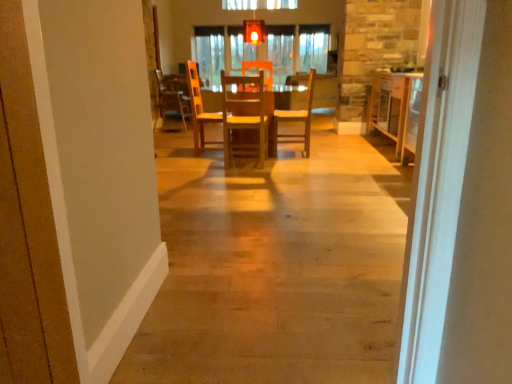
Describe the element at coordinates (396, 109) in the screenshot. The image size is (512, 384). I see `wooden table at center, which is the 2th table from left to right` at that location.

What is the approximate height of wooden chair at center, which ranks as the 2th chair in back-to-front order?

wooden chair at center, which ranks as the 2th chair in back-to-front order, is 37.61 inches in height.

Identify the location of matte glass light fixture at upper center. (254, 31).

Describe the element at coordinates (288, 116) in the screenshot. I see `wooden table at center, the second table when ordered from right to left` at that location.

The height and width of the screenshot is (384, 512). What do you see at coordinates (275, 268) in the screenshot? I see `wooden floor at center` at bounding box center [275, 268].

I want to click on wooden table at center, marked as the 1th table in a right-to-left arrangement, so (x=396, y=109).

Is matte glass light fixture at upper center at the right side of wooden chair at center, the second chair positioned from the front?

No, matte glass light fixture at upper center is not to the right of wooden chair at center, the second chair positioned from the front.

At what (x,y) coordinates should I click in order to perform the action: click on light fixture located above the wooden chair at center, the third chair when ordered from left to right (from the image's perspective). Please return your answer as a coordinate pair (x, y). Looking at the image, I should click on (254, 31).

Are matte glass light fixture at upper center and wooden chair at center, marked as the first chair in a right-to-left arrangement, far apart?

matte glass light fixture at upper center is positioned a significant distance from wooden chair at center, marked as the first chair in a right-to-left arrangement.

Can you confirm if matte glass light fixture at upper center is shorter than wooden chair at center, the second chair positioned from the front?

Indeed, matte glass light fixture at upper center has a lesser height compared to wooden chair at center, the second chair positioned from the front.

Is wooden chair at center, the third chair when ordered from left to right, a part of wooden table at center, which is the 1th table in left-to-right order?

Yes, wooden chair at center, the third chair when ordered from left to right, is a part of wooden table at center, which is the 1th table in left-to-right order.

From the picture: Could you tell me if wooden table at center, the second table when ordered from right to left, is facing wooden chair at center, marked as the first chair in a right-to-left arrangement?

No, wooden table at center, the second table when ordered from right to left, is not turned towards wooden chair at center, marked as the first chair in a right-to-left arrangement.

From a real-world perspective, who is located higher, wooden table at center, the second table when ordered from right to left, or wooden chair at center, which ranks as the 2th chair in back-to-front order?

In real-world perspective, wooden chair at center, which ranks as the 2th chair in back-to-front order, is above.

Considering the sizes of wooden table at center, which is the 1th table in left-to-right order, and wooden chair at center, marked as the first chair in a right-to-left arrangement, in the image, is wooden table at center, which is the 1th table in left-to-right order, wider or thinner than wooden chair at center, marked as the first chair in a right-to-left arrangement,?

Result: wooden table at center, which is the 1th table in left-to-right order, is wider than wooden chair at center, marked as the first chair in a right-to-left arrangement.

Looking at this image, can you tell me how much matte glass light fixture at upper center and wooden chair at center, which is the first chair from left to right, differ in facing direction?

There is a 95.3-degree angle between the facing directions of matte glass light fixture at upper center and wooden chair at center, which is the first chair from left to right.

Is point (263, 33) closer or farther from the camera than point (168, 91)?

Clearly, point (263, 33) is closer to the camera than point (168, 91).

Considering the relative sizes of matte glass light fixture at upper center and wooden chair at center, the first chair in the back-to-front sequence, in the image provided, is matte glass light fixture at upper center taller than wooden chair at center, the first chair in the back-to-front sequence,?

No.

From a real-world perspective, which is physically above, matte glass light fixture at upper center or wooden chair at center, which appears as the 3th chair when viewed from the right?

matte glass light fixture at upper center is physically above.

Consider the image. From the image's perspective, would you say wooden chair at center, marked as the first chair in a right-to-left arrangement, is shown under wooden floor at center?

Actually, wooden chair at center, marked as the first chair in a right-to-left arrangement, appears above wooden floor at center in the image.

Between wooden chair at center, marked as the first chair in a right-to-left arrangement, and wooden floor at center, which one has smaller width?

Thinner between the two is wooden chair at center, marked as the first chair in a right-to-left arrangement.

Is wooden chair at center, marked as the first chair in a right-to-left arrangement, aimed at wooden floor at center?

No, wooden chair at center, marked as the first chair in a right-to-left arrangement, is not turned towards wooden floor at center.

Is wooden chair at center, marked as the first chair in a right-to-left arrangement, bigger than wooden floor at center?

Incorrect, wooden chair at center, marked as the first chair in a right-to-left arrangement, is not larger than wooden floor at center.

Based on the photo, is wooden floor at center completely or partially inside matte glass light fixture at upper center?

Definitely not — wooden floor at center is not inside matte glass light fixture at upper center.

Considering the sizes of matte glass light fixture at upper center and wooden floor at center in the image, is matte glass light fixture at upper center bigger or smaller than wooden floor at center?

In the image, matte glass light fixture at upper center appears to be smaller than wooden floor at center.

Are matte glass light fixture at upper center and wooden floor at center located far from each other?

Yes, matte glass light fixture at upper center is far from wooden floor at center.

From the image's perspective, which one is positioned higher, matte glass light fixture at upper center or wooden floor at center?

matte glass light fixture at upper center.

Is wooden table at center, the second table when ordered from right to left, positioned with its back to wooden chair at center, marked as the 1th chair in a front-to-back arrangement?

Yes, wooden table at center, the second table when ordered from right to left, is facing away from wooden chair at center, marked as the 1th chair in a front-to-back arrangement.

From the image's perspective, which one is positioned higher, wooden table at center, which is the 1th table in left-to-right order, or wooden chair at center, marked as the 2th chair in a right-to-left arrangement?

wooden table at center, which is the 1th table in left-to-right order, is shown above in the image.

Considering the relative sizes of wooden table at center, the second table when ordered from right to left, and wooden chair at center, which ranks as the third chair in back-to-front order, in the image provided, is wooden table at center, the second table when ordered from right to left, bigger than wooden chair at center, which ranks as the third chair in back-to-front order,?

Correct, wooden table at center, the second table when ordered from right to left, is larger in size than wooden chair at center, which ranks as the third chair in back-to-front order.

Does point (244, 134) lie in front of point (257, 139)?

No, it is not.

Looking at this image, considering the sizes of wooden table at center, which is the 1th table in left-to-right order, and wooden floor at center in the image, is wooden table at center, which is the 1th table in left-to-right order, bigger or smaller than wooden floor at center?

wooden table at center, which is the 1th table in left-to-right order, is smaller than wooden floor at center.

Between wooden table at center, which is the 1th table in left-to-right order, and wooden floor at center, which one has more height?

wooden table at center, which is the 1th table in left-to-right order, is taller.

Is wooden table at center, which is the 1th table in left-to-right order, closer to the viewer compared to wooden floor at center?

No, the depth of wooden table at center, which is the 1th table in left-to-right order, is greater than that of wooden floor at center.

From a real-world perspective, which is physically below, wooden table at center, which is the 1th table in left-to-right order, or wooden floor at center?

wooden floor at center is physically lower.

This screenshot has height=384, width=512. I want to click on chair that is the 2nd object located below the matte glass light fixture at upper center (from the image's perspective), so [298, 118].

Find the location of a particular element. This screenshot has height=384, width=512. the 2nd table located beneath the wooden chair at center, which ranks as the 2th chair in back-to-front order (from a real-world perspective) is located at coordinates (288, 116).

Which object lies further to the anchor point wooden chair at center, the third chair when ordered from left to right, wooden floor at center or matte glass light fixture at upper center?

Among the two, wooden floor at center is located further to wooden chair at center, the third chair when ordered from left to right.

Which object lies nearer to the anchor point wooden table at center, which is the 1th table in left-to-right order, wooden table at center, marked as the 1th table in a right-to-left arrangement, or wooden chair at center, marked as the 1th chair in a front-to-back arrangement?

wooden chair at center, marked as the 1th chair in a front-to-back arrangement.

Looking at the image, which one is located closer to wooden table at center, marked as the 1th table in a right-to-left arrangement, wooden chair at center, the 3th chair in the front-to-back sequence, or wooden chair at center, marked as the 2th chair in a right-to-left arrangement?

wooden chair at center, marked as the 2th chair in a right-to-left arrangement, lies closer to wooden table at center, marked as the 1th table in a right-to-left arrangement, than the other object.

Looking at the image, which one is located further to wooden chair at center, marked as the 2th chair in a right-to-left arrangement, wooden table at center, which is the 2th table from left to right, or wooden table at center, which is the 1th table in left-to-right order?

wooden table at center, which is the 2th table from left to right, lies further to wooden chair at center, marked as the 2th chair in a right-to-left arrangement, than the other object.

Considering their positions, is wooden table at center, the second table when ordered from right to left, positioned closer to matte glass light fixture at upper center than wooden chair at center, the 3th chair in the front-to-back sequence?

wooden table at center, the second table when ordered from right to left, is closer to matte glass light fixture at upper center.

Looking at the image, which one is located further to wooden chair at center, marked as the 2th chair in a right-to-left arrangement, wooden chair at center, the first chair in the back-to-front sequence, or wooden table at center, the second table when ordered from right to left?

Based on the image, wooden chair at center, the first chair in the back-to-front sequence, appears to be further to wooden chair at center, marked as the 2th chair in a right-to-left arrangement.

Considering their positions, is wooden table at center, the second table when ordered from right to left, positioned further to wooden chair at center, marked as the first chair in a right-to-left arrangement, than wooden chair at center, which appears as the 3th chair when viewed from the right?

wooden chair at center, which appears as the 3th chair when viewed from the right, lies further to wooden chair at center, marked as the first chair in a right-to-left arrangement, than the other object.

Based on their spatial positions, is wooden table at center, which is the 1th table in left-to-right order, or wooden chair at center, which ranks as the third chair in back-to-front order, closer to wooden chair at center, the second chair positioned from the front?

wooden table at center, which is the 1th table in left-to-right order, lies closer to wooden chair at center, the second chair positioned from the front, than the other object.

This screenshot has width=512, height=384. I want to click on chair positioned between wooden chair at center, which ranks as the third chair in back-to-front order, and wooden chair at center, the first chair in the back-to-front sequence, from near to far, so click(298, 118).

At what (x,y) coordinates should I click in order to perform the action: click on chair between wooden chair at center, marked as the 2th chair in a right-to-left arrangement, and wooden table at center, which is the 2th table from left to right, in the horizontal direction. Please return your answer as a coordinate pair (x, y). Looking at the image, I should click on (298, 118).

The height and width of the screenshot is (384, 512). What are the coordinates of `light fixture between wooden table at center, the second table when ordered from right to left, and wooden table at center, which is the 2th table from left to right, in the horizontal direction` in the screenshot? It's located at (254, 31).

Where is `light fixture between wooden chair at center, marked as the 1th chair in a front-to-back arrangement, and wooden chair at center, which is the first chair from left to right, in the front-back direction`? The width and height of the screenshot is (512, 384). light fixture between wooden chair at center, marked as the 1th chair in a front-to-back arrangement, and wooden chair at center, which is the first chair from left to right, in the front-back direction is located at coordinates (254, 31).